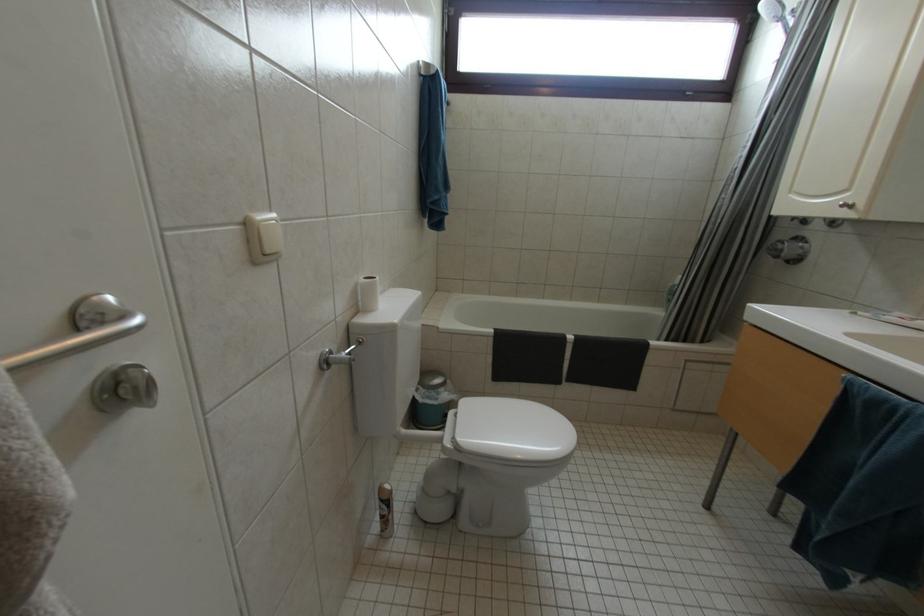
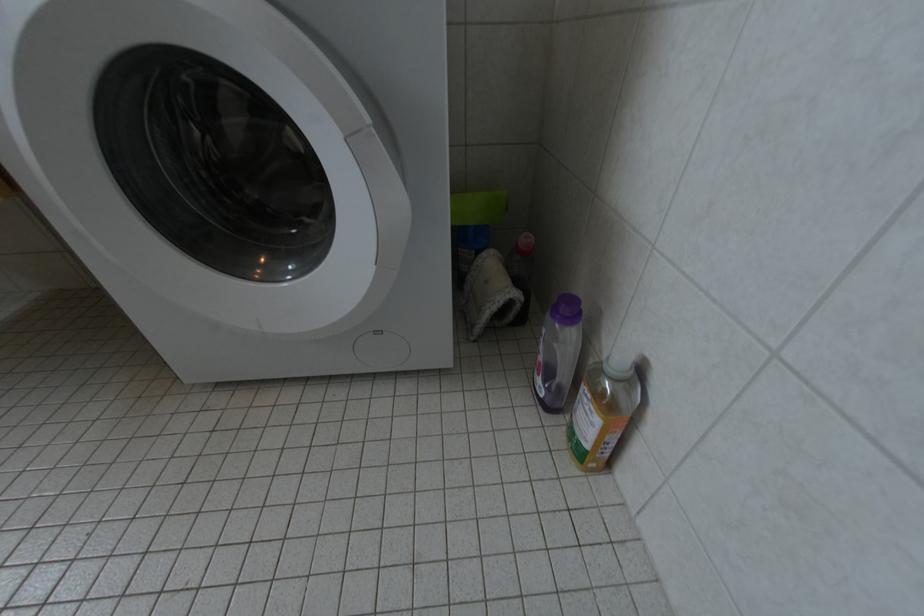
How did the camera likely rotate?

The camera's rotation is toward right-down.